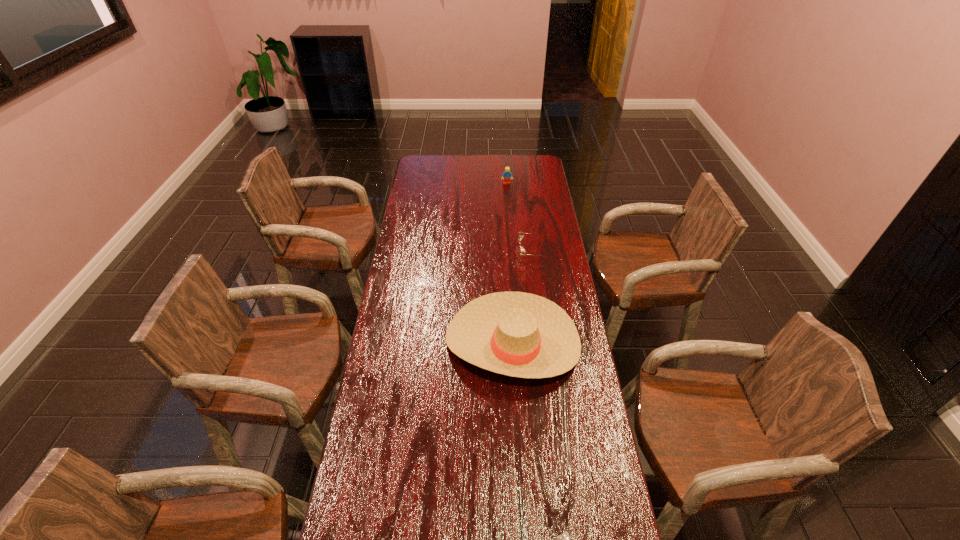
The width and height of the screenshot is (960, 540). What are the coordinates of `vacant point located on the front lenses of the third nearest object` in the screenshot? It's located at (496, 252).

Locate an element on the screen. The height and width of the screenshot is (540, 960). sunhat at the right edge is located at coordinates (518, 334).

Locate an element on the screen. sunglasses at the right edge is located at coordinates (522, 252).

I want to click on free space at the far edge, so click(x=457, y=168).

Image resolution: width=960 pixels, height=540 pixels. I want to click on vacant space at the left edge of the desktop, so click(x=420, y=181).

Locate an element on the screen. vacant space at the right edge is located at coordinates (559, 477).

In the image, there is a desktop. Where is `vacant space at the far right corner`? vacant space at the far right corner is located at coordinates (543, 170).

Where is `free space between the sunhat and the farthest object`? The width and height of the screenshot is (960, 540). free space between the sunhat and the farthest object is located at coordinates point(510,263).

You are a GUI agent. You are given a task and a screenshot of the screen. Output one action in this format:
    pyautogui.click(x=<x>, y=<y>)
    Task: Click on the vacant point located between the third shortest object and the sunhat
    This screenshot has height=540, width=960.
    Given the screenshot: What is the action you would take?
    pyautogui.click(x=510, y=263)

Locate an element on the screen. The image size is (960, 540). free spot between the sunhat and the third shortest object is located at coordinates (510, 263).